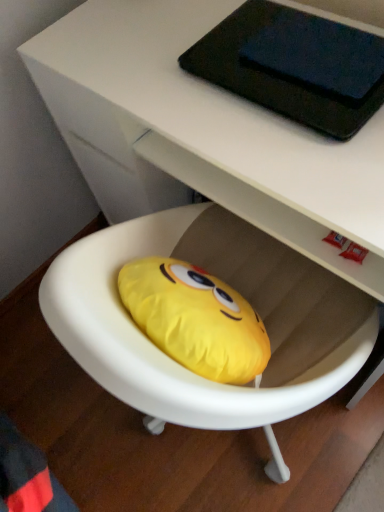
Question: Would you say yellow fabric bean bag at center is to the left or to the right of black matte tablet at upper center in the picture?

Choices:
 (A) left
 (B) right

Answer: (A)

Question: From a real-world perspective, is yellow fabric bean bag at center physically located above or below black matte tablet at upper center?

Choices:
 (A) above
 (B) below

Answer: (B)

Question: From the image's perspective, relative to black matte tablet at upper center, is yellow fabric bean bag at center above or below?

Choices:
 (A) above
 (B) below

Answer: (B)

Question: Is black matte tablet at upper center inside the boundaries of yellow fabric bean bag at center, or outside?

Choices:
 (A) inside
 (B) outside

Answer: (A)

Question: Looking at their shapes, would you say black matte tablet at upper center is wider or thinner than yellow fabric bean bag at center?

Choices:
 (A) wide
 (B) thin

Answer: (B)

Question: Considering the relative positions of black matte tablet at upper center and yellow fabric bean bag at center in the image provided, is black matte tablet at upper center to the left or to the right of yellow fabric bean bag at center?

Choices:
 (A) left
 (B) right

Answer: (B)

Question: Considering the positions of black matte tablet at upper center and yellow fabric bean bag at center in the image, is black matte tablet at upper center taller or shorter than yellow fabric bean bag at center?

Choices:
 (A) short
 (B) tall

Answer: (A)